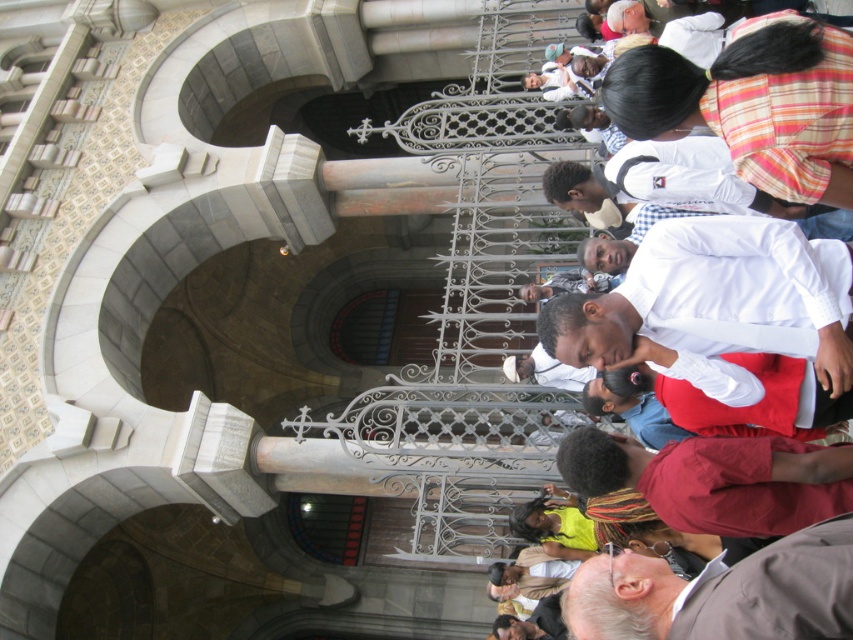
You are a photographer standing at the entrance of the grand stone building. You want to take a photo that includes both the white cotton shirt at center and the gray fabric at lower right. What is the minimum distance you need to move backward to ensure both objects are in frame?

The white cotton shirt at center is 3.91 meters from the gray fabric at lower right. To include both in the frame, you need to move backward at least 3.91 meters to ensure both are visible.

You are a photographer trying to capture a clear shot of both the white cotton shirt at center and the gray fabric at lower right. Since you want to ensure both are visible in the frame, which object should you focus on first to account for their sizes?

The white cotton shirt at center is taller than the gray fabric at lower right, so you should focus on the white cotton shirt at center first to ensure its full height is captured before adjusting for the smaller gray fabric at lower right.

You are a photographer standing at the entrance of the grand stone building. You want to take a photo of the white cotton shirt at center and the gray fabric at lower right. Which object is closer to the camera?

The white cotton shirt at center is closer to the camera because the gray fabric at lower right is behind it.